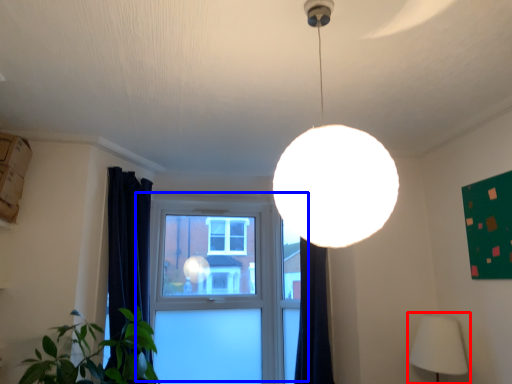
Question: Which object appears closest to the camera in this image, lamp (highlighted by a red box) or window (highlighted by a blue box)?

Choices:
 (A) lamp
 (B) window

Answer: (A)